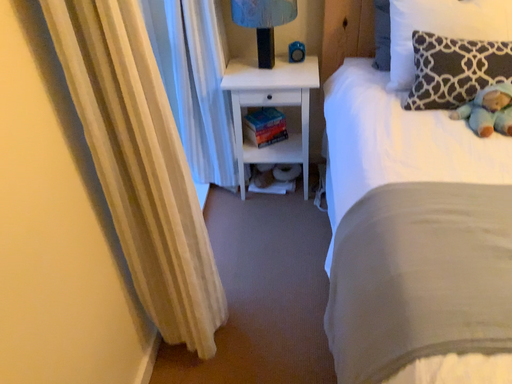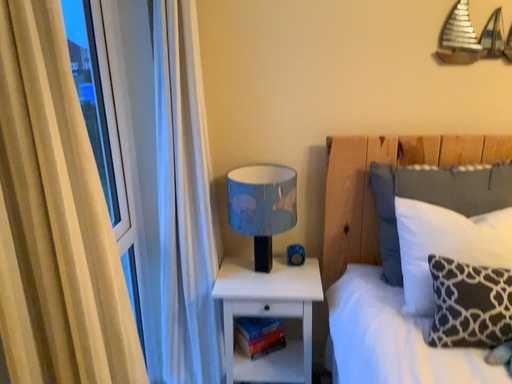
Question: Which way did the camera rotate in the video?

Choices:
 (A) rotated downward
 (B) rotated upward

Answer: (B)